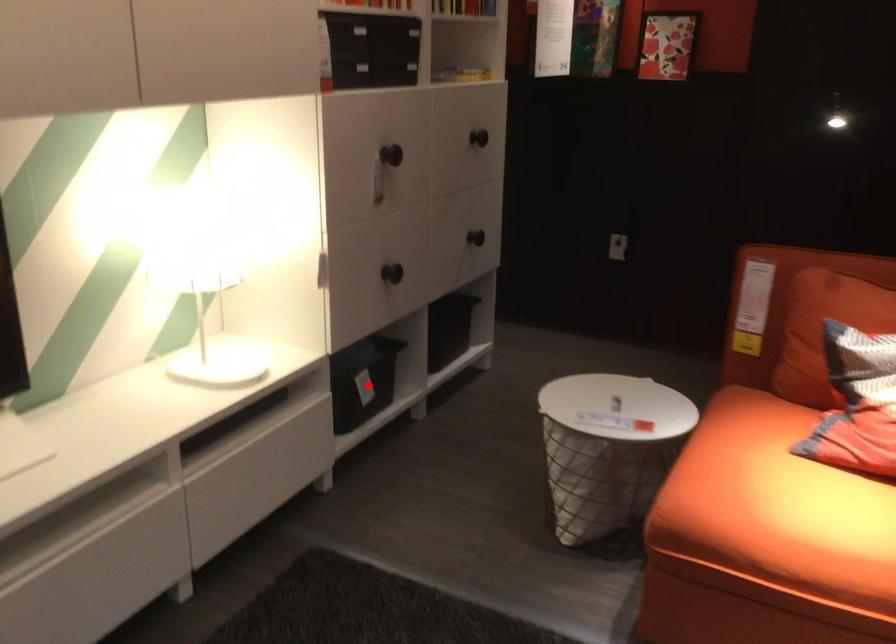
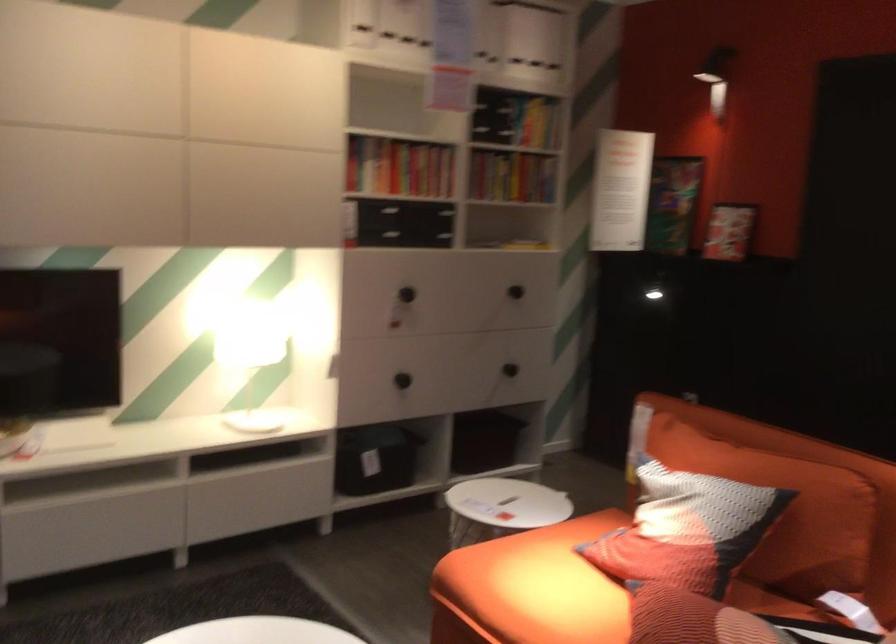
Question: I am providing you with two images of the same scene from different viewpoints. A red point is shown in image1. For the corresponding object point in image2, is it positioned nearer or farther from the camera?

Choices:
 (A) Nearer
 (B) Farther

Answer: (B)